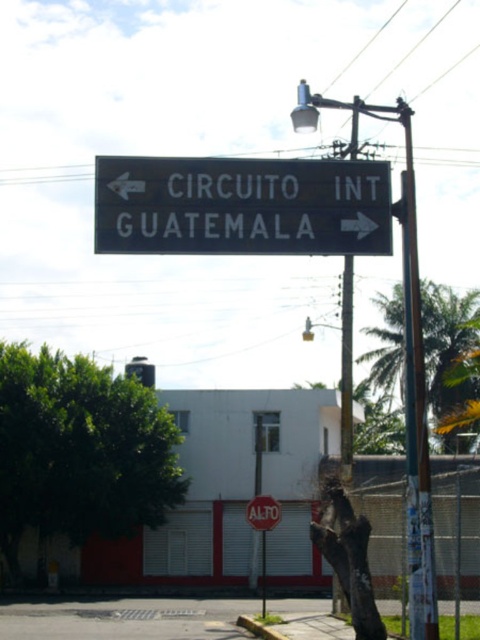
You are a delivery driver who needs to deliver a package to the building in the scene. You are driving a truck that is 3 meters wide. The road is narrow between the black metal sign at center and the stop sign. Can your truck pass through the space between them?

The distance between the black metal sign at center and the stop sign is 12.70 meters. Since the truck is only 3 meters wide, there is ample space for the truck to pass through the narrow road between them.